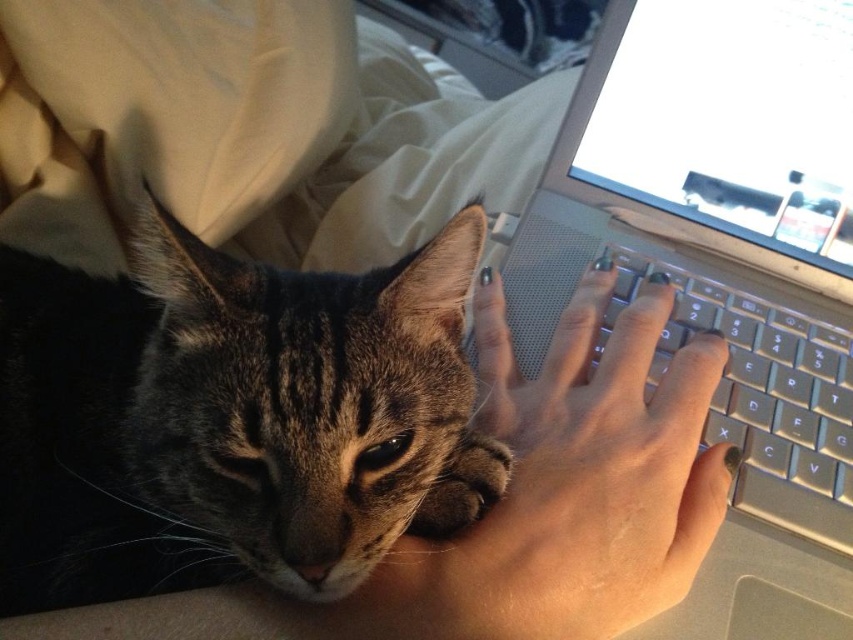
Question: Can you confirm if tabby fur cat at center is positioned to the right of silver metallic keyboard at center right?

Choices:
 (A) no
 (B) yes

Answer: (A)

Question: Does silver metallic laptop at center have a greater width compared to smooth skin hand at center?

Choices:
 (A) no
 (B) yes

Answer: (A)

Question: Is silver metallic laptop at center below smooth skin hand at center?

Choices:
 (A) no
 (B) yes

Answer: (A)

Question: Which point is farther to the camera?

Choices:
 (A) (498, 536)
 (B) (379, 440)

Answer: (A)

Question: Which point is closer to the camera taking this photo?

Choices:
 (A) (142, 525)
 (B) (729, 182)
 (C) (631, 432)
 (D) (761, 276)

Answer: (C)

Question: Which object appears farthest from the camera in this image?

Choices:
 (A) silver metallic laptop at center
 (B) tabby fur cat at center
 (C) smooth skin hand at center
 (D) silver metallic keyboard at center right

Answer: (D)